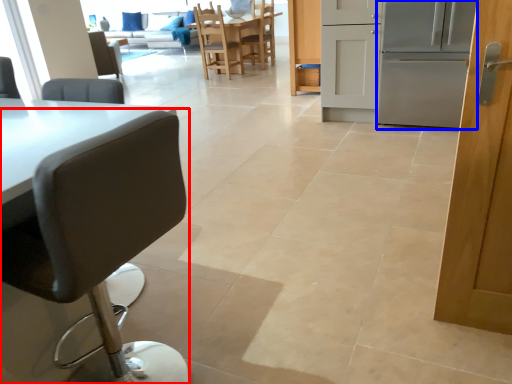
Question: Which point is closer to the camera, chair (highlighted by a red box) or oven (highlighted by a blue box)?

Choices:
 (A) chair
 (B) oven

Answer: (A)